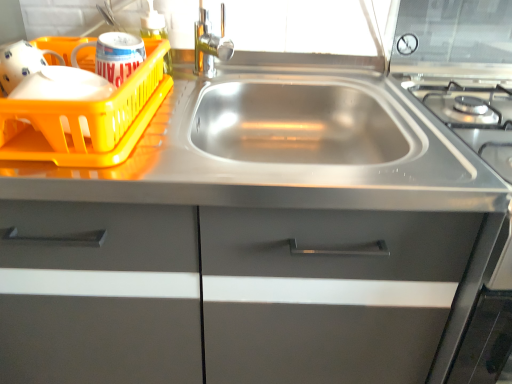
Question: Does stainless steel sink at center turn towards transparent plastic soap dispenser at upper center?

Choices:
 (A) yes
 (B) no

Answer: (B)

Question: From a real-world perspective, is stainless steel sink at center located higher than transparent plastic soap dispenser at upper center?

Choices:
 (A) yes
 (B) no

Answer: (B)

Question: Is stainless steel sink at center smaller than transparent plastic soap dispenser at upper center?

Choices:
 (A) yes
 (B) no

Answer: (B)

Question: Is stainless steel sink at center positioned beyond the bounds of transparent plastic soap dispenser at upper center?

Choices:
 (A) yes
 (B) no

Answer: (A)

Question: Considering the relative positions of stainless steel sink at center and transparent plastic soap dispenser at upper center in the image provided, is stainless steel sink at center to the right of transparent plastic soap dispenser at upper center from the viewer's perspective?

Choices:
 (A) yes
 (B) no

Answer: (A)

Question: From a real-world perspective, relative to stainless steel sink at center, is yellow plastic basket at left vertically above or below?

Choices:
 (A) above
 (B) below

Answer: (A)

Question: Considering the positions of yellow plastic basket at left and stainless steel sink at center in the image, is yellow plastic basket at left bigger or smaller than stainless steel sink at center?

Choices:
 (A) big
 (B) small

Answer: (B)

Question: Considering the positions of point (110, 109) and point (297, 160), is point (110, 109) closer or farther from the camera than point (297, 160)?

Choices:
 (A) farther
 (B) closer

Answer: (B)

Question: Is yellow plastic basket at left spatially inside stainless steel sink at center, or outside of it?

Choices:
 (A) inside
 (B) outside

Answer: (B)

Question: Relative to yellow plastic basket at left, is transparent plastic soap dispenser at upper center in front or behind?

Choices:
 (A) behind
 (B) front

Answer: (A)

Question: In terms of size, does transparent plastic soap dispenser at upper center appear bigger or smaller than yellow plastic basket at left?

Choices:
 (A) small
 (B) big

Answer: (A)

Question: From their relative heights in the image, would you say transparent plastic soap dispenser at upper center is taller or shorter than yellow plastic basket at left?

Choices:
 (A) short
 (B) tall

Answer: (B)

Question: Does point (141, 31) appear closer or farther from the camera than point (51, 107)?

Choices:
 (A) farther
 (B) closer

Answer: (A)

Question: Looking at the image, does yellow plastic basket at left seem bigger or smaller compared to stainless steel sink at center?

Choices:
 (A) big
 (B) small

Answer: (B)

Question: Is point (82, 157) closer or farther from the camera than point (96, 314)?

Choices:
 (A) closer
 (B) farther

Answer: (A)